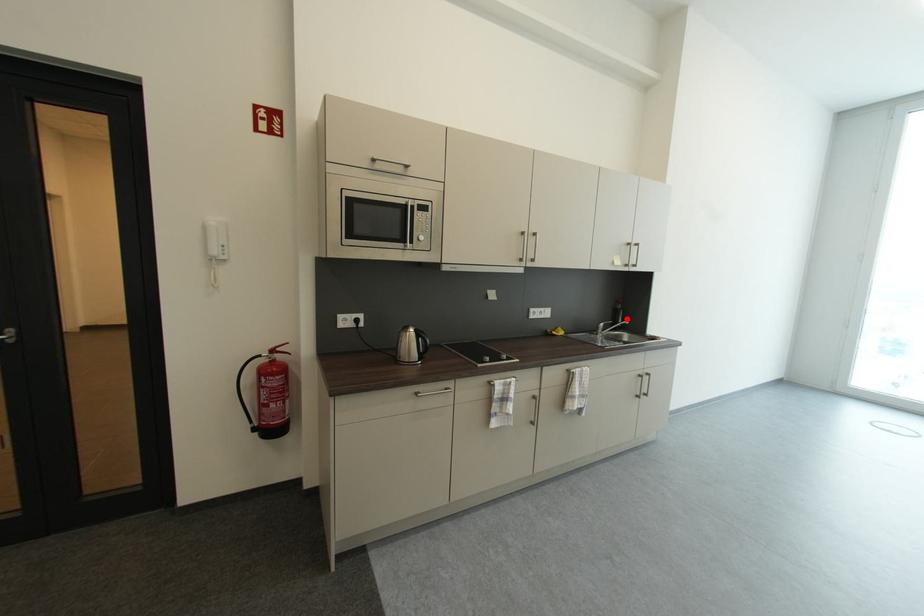
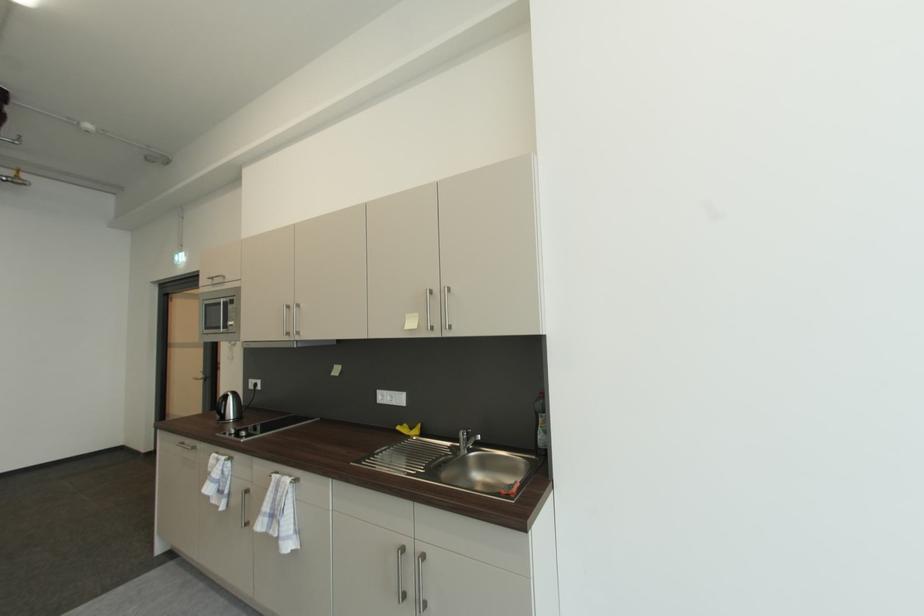
In the second image, find the point that corresponds to the highlighted location in the first image.

(545, 430)